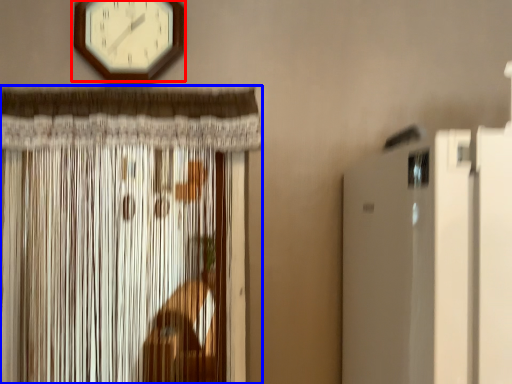
Question: Which point is closer to the camera, wall clock (highlighted by a red box) or curtain (highlighted by a blue box)?

Choices:
 (A) wall clock
 (B) curtain

Answer: (B)